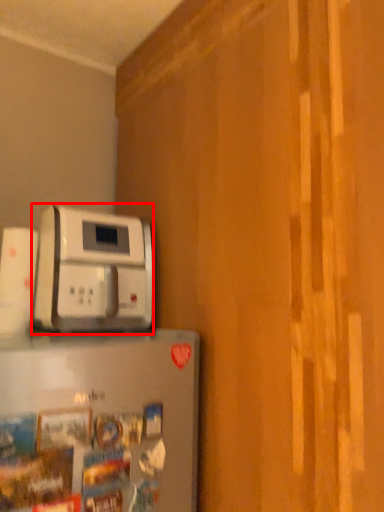
Question: From the image, what is the correct spatial relationship of home appliance (annotated by the red box) in relation to home appliance?

Choices:
 (A) left
 (B) right

Answer: (A)